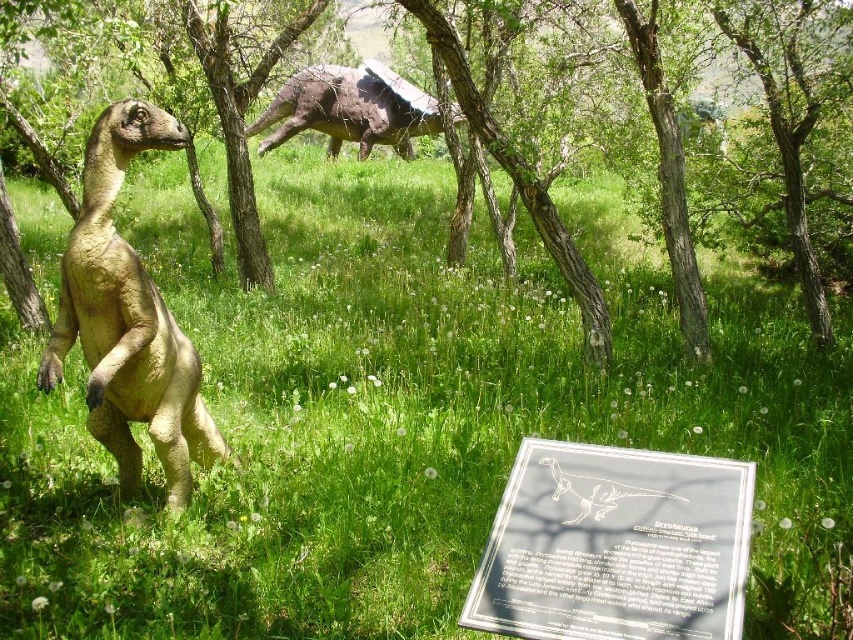
Question: Which point is closer to the camera?

Choices:
 (A) (347, 118)
 (B) (677, 572)
 (C) (799, 188)
 (D) (94, 227)

Answer: (B)

Question: Does transparent glass sign at center have a lesser width compared to matte brown dinosaur at left?

Choices:
 (A) yes
 (B) no

Answer: (B)

Question: Does matte brown dinosaur at left appear on the left side of green matte tree at center?

Choices:
 (A) yes
 (B) no

Answer: (A)

Question: Among these points, which one is nearest to the camera?

Choices:
 (A) coord(480,129)
 (B) coord(271,145)
 (C) coord(645,586)
 (D) coord(172,320)

Answer: (C)

Question: Which of the following is the closest to the observer?

Choices:
 (A) (332, 104)
 (B) (91, 356)
 (C) (595, 461)

Answer: (C)

Question: Is transparent glass sign at center positioned behind matte brown dinosaur at left?

Choices:
 (A) no
 (B) yes

Answer: (A)